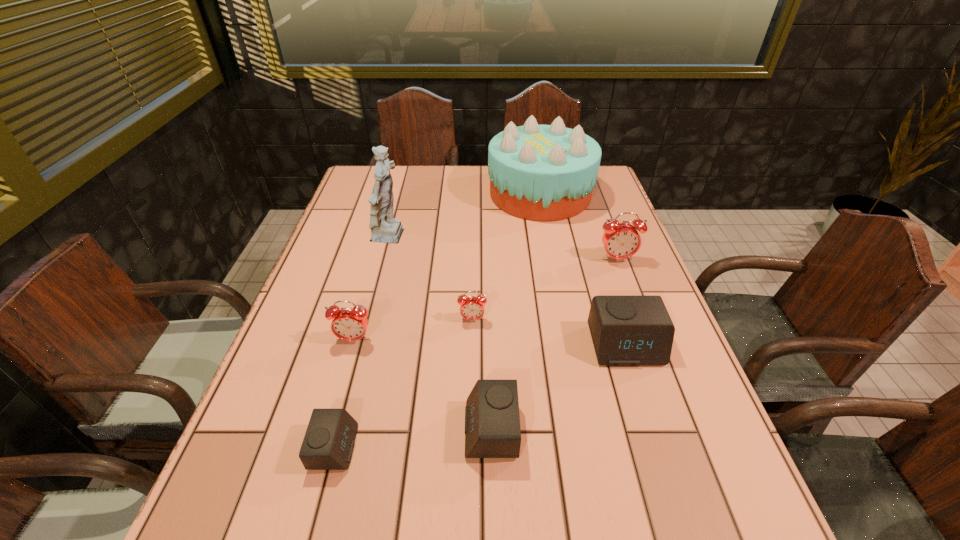
Where is `vacant point that satisfies the following two spatial constraints: 1. on the face of the rightmost red alarm clock; 2. on the front-facing side of the second black alarm clock from left to right`? vacant point that satisfies the following two spatial constraints: 1. on the face of the rightmost red alarm clock; 2. on the front-facing side of the second black alarm clock from left to right is located at coordinates tap(681, 430).